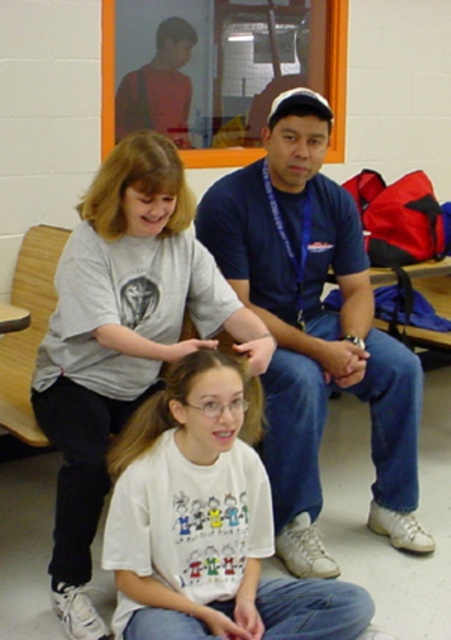
You are an interior designer assessing the space for a new piece of furniture. You notice the white cotton shirt at lower center and the brown silky hair at center. Which object occupies more horizontal space in the image?

The white cotton shirt at lower center might be wider than brown silky hair at center according to the description.

In the scene described, there is a white cotton shirt at center and a brown silky hair at center. Which object is positioned higher relative to the other?

The white cotton shirt at center is located above the brown silky hair at center, so it is positioned higher.

You are an observer looking at the scene. Which object, the white cotton shirt at center or the blondehair at upper left, is taller?

The white cotton shirt at center is taller than the blondehair at upper left.